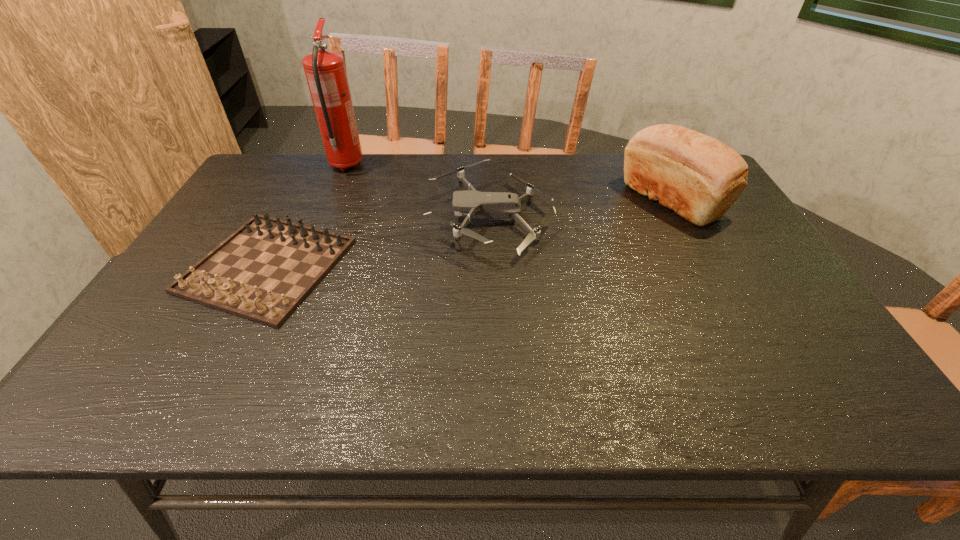
The width and height of the screenshot is (960, 540). In order to click on fire extinguisher present at the far edge in this screenshot , I will do `click(325, 71)`.

Where is `bread positioned at the far edge`? bread positioned at the far edge is located at coordinates (698, 177).

Find the location of a particular element. drone present at the far edge is located at coordinates (478, 205).

Image resolution: width=960 pixels, height=540 pixels. Find the location of `object that is at the left edge`. object that is at the left edge is located at coordinates (263, 271).

Find the location of `object that is at the right edge`. object that is at the right edge is located at coordinates (698, 177).

Find the location of a particular element. object present at the far right corner is located at coordinates (698, 177).

Identify the location of free space at the far edge of the desktop. (396, 186).

Where is `vacant area at the near edge`? Image resolution: width=960 pixels, height=540 pixels. vacant area at the near edge is located at coordinates (626, 379).

In the image, there is a desktop. In order to click on vacant space at the left edge in this screenshot , I will do `click(232, 205)`.

In the image, there is a desktop. In order to click on vacant space at the right edge in this screenshot , I will do `click(764, 255)`.